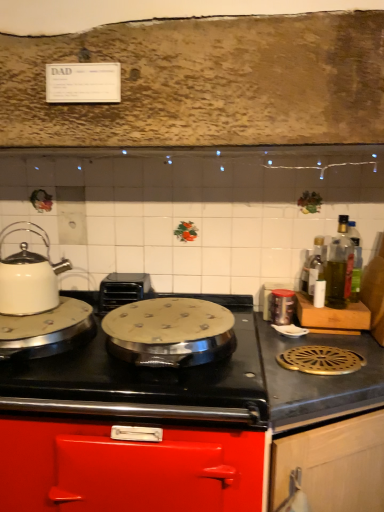
Question: Considering their positions, is green glass bottle at right, the 3th bottle viewed from the left, located in front of or behind silver metallic wok at center?

Choices:
 (A) front
 (B) behind

Answer: (B)

Question: From the image's perspective, is green glass bottle at right, positioned as the first bottle in right-to-left order, above or below silver metallic wok at center?

Choices:
 (A) above
 (B) below

Answer: (A)

Question: Which object is positioned farthest from the metallic red cabinet at center, which is the 2th cabinetry in right-to-left order?

Choices:
 (A) black plastic toaster at center-left
 (B) white glossy kettle at left, which is the 1th kitchen appliance from left to right
 (C) metallic gray stovetop at right
 (D) clear glass bottle at right, placed as the 1th bottle when sorted from left to right
 (E) green glass bottle at right, which is counted as the 2th bottle, starting from the left

Answer: (D)

Question: Which object is the farthest from the metallic canister at right, arranged as the 1th kitchen appliance when viewed from the right?

Choices:
 (A) black plastic toaster at center-left
 (B) silver metallic wok at center
 (C) metallic gray stovetop at right
 (D) wooden cabinet door at lower right, the 1th cabinetry viewed from the right
 (E) metallic red cabinet at center, which is the 2th cabinetry in right-to-left order

Answer: (E)